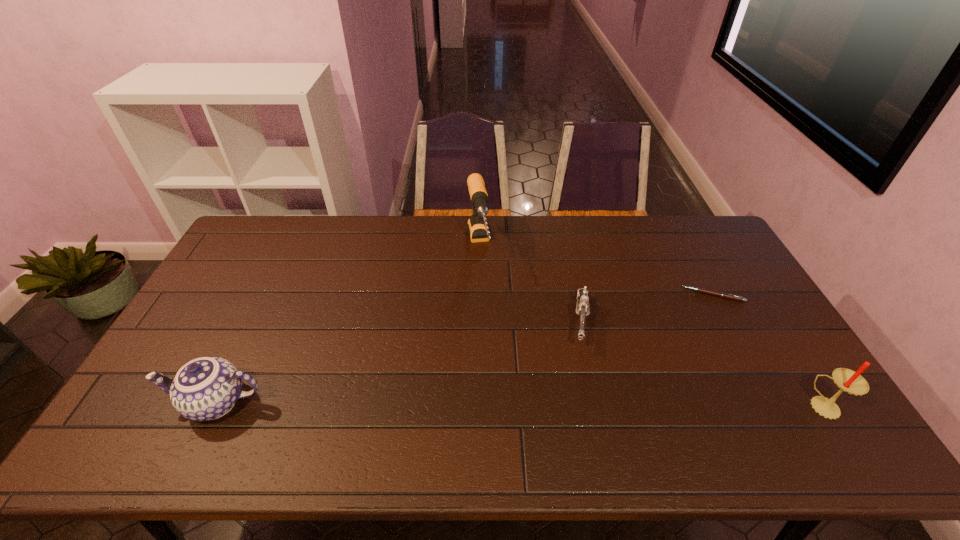
Find the location of a particular element. free space on the desktop that is between the leftmost object and the candle and is positioned aimed along the barrel of the gun is located at coordinates (575, 404).

You are a GUI agent. You are given a task and a screenshot of the screen. Output one action in this format:
    pyautogui.click(x=<x>, y=<y>)
    Task: Click on the vacant spot on the desktop that is between the chinaware and the rightmost object and is positioned at the nib of the pen
    This screenshot has width=960, height=540.
    Given the screenshot: What is the action you would take?
    pyautogui.click(x=572, y=404)

Locate an element on the screen. The width and height of the screenshot is (960, 540). free space on the desktop that is between the leftmost object and the rightmost object and is positioned on the handle side of the second object from left to right is located at coordinates (512, 404).